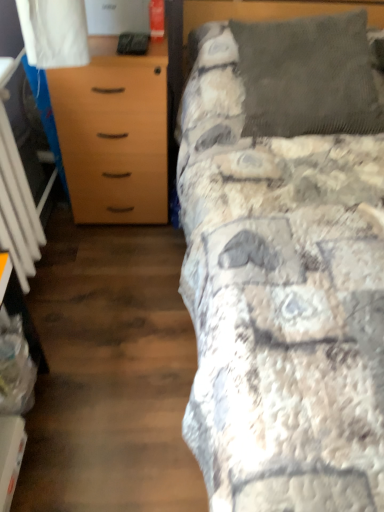
Question: Is dark gray corduroy pillow at upper right bigger or smaller than textured gray blanket at upper right?

Choices:
 (A) small
 (B) big

Answer: (A)

Question: From the image's perspective, is dark gray corduroy pillow at upper right located above or below textured gray blanket at upper right?

Choices:
 (A) above
 (B) below

Answer: (A)

Question: Estimate the real-world distances between objects in this image. Which object is closer to the dark gray corduroy pillow at upper right?

Choices:
 (A) textured gray blanket at upper right
 (B) light brown wood chest of drawers at left
 (C) white plastic radiator at left

Answer: (A)

Question: Which is farther from the light brown wood chest of drawers at left?

Choices:
 (A) white plastic radiator at left
 (B) dark gray corduroy pillow at upper right
 (C) textured gray blanket at upper right

Answer: (B)